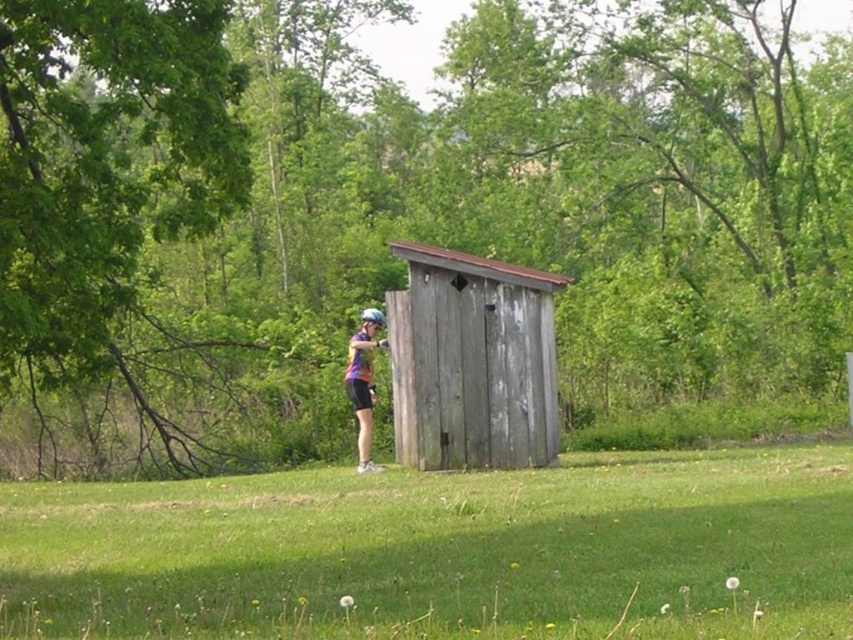
You are standing at the point marked by coordinates (473,362) in the image. What structure are you currently positioned on?

You are positioned on the weathered wood hut at center, as the point (473,362) is located on it.

Consider the image. You are standing at point [444,552] in the scene. What is the terrain like here?

The terrain at point [444,552] is green grass at center.